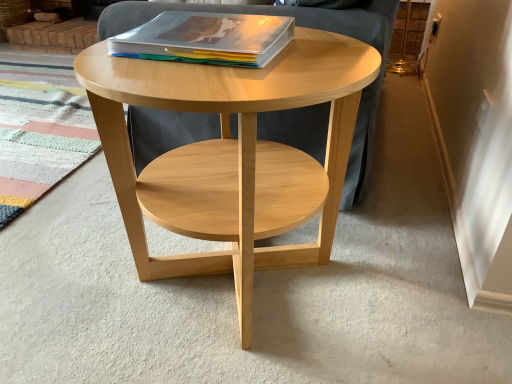
Question: Does natural wood coffee table at center have a smaller size compared to matte plastic magazine at center?

Choices:
 (A) no
 (B) yes

Answer: (A)

Question: Does natural wood coffee table at center have a greater height compared to matte plastic magazine at center?

Choices:
 (A) no
 (B) yes

Answer: (B)

Question: From a real-world perspective, does natural wood coffee table at center stand above matte plastic magazine at center?

Choices:
 (A) no
 (B) yes

Answer: (A)

Question: Is natural wood coffee table at center positioned in front of matte plastic magazine at center?

Choices:
 (A) yes
 (B) no

Answer: (A)

Question: Considering the relative sizes of natural wood coffee table at center and matte plastic magazine at center in the image provided, is natural wood coffee table at center wider than matte plastic magazine at center?

Choices:
 (A) no
 (B) yes

Answer: (B)

Question: Is natural wood coffee table at center next to matte plastic magazine at center?

Choices:
 (A) no
 (B) yes

Answer: (A)

Question: From a real-world perspective, is matte plastic magazine at center located beneath natural wood coffee table at center?

Choices:
 (A) yes
 (B) no

Answer: (B)

Question: Is matte plastic magazine at center thinner than natural wood coffee table at center?

Choices:
 (A) yes
 (B) no

Answer: (A)

Question: Considering the relative positions of matte plastic magazine at center and natural wood coffee table at center in the image provided, is matte plastic magazine at center to the left of natural wood coffee table at center from the viewer's perspective?

Choices:
 (A) yes
 (B) no

Answer: (A)

Question: From a real-world perspective, is matte plastic magazine at center located higher than natural wood coffee table at center?

Choices:
 (A) yes
 (B) no

Answer: (A)

Question: Is matte plastic magazine at center aimed at natural wood coffee table at center?

Choices:
 (A) yes
 (B) no

Answer: (B)

Question: Is matte plastic magazine at center turned away from natural wood coffee table at center?

Choices:
 (A) yes
 (B) no

Answer: (B)

Question: Considering the relative positions of natural wood coffee table at center and matte plastic magazine at center in the image provided, is natural wood coffee table at center to the left or to the right of matte plastic magazine at center?

Choices:
 (A) left
 (B) right

Answer: (B)